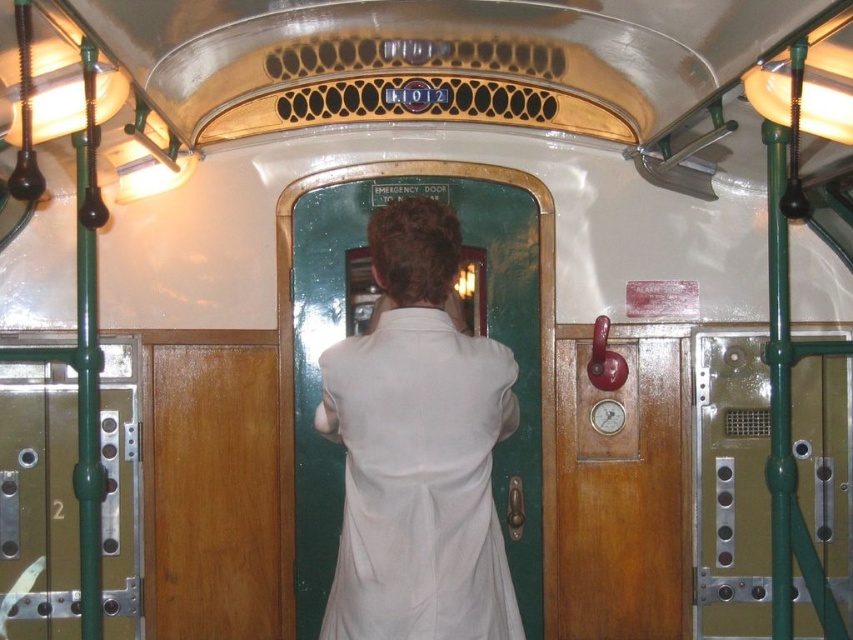
Based on the photo, you are a passenger in the vintage train car and want to find the emergency door. The white matte dress at center is blocking your view. Where should you move to so that you can see the emergency door clearly?

Since the white matte dress at center is located at point (419,481), moving to a position that is not obstructed by it would allow you to see the emergency door. The exact coordinates to move to depend on the layout of the train car, but moving to the left or right of the white matte dress at center should provide an unobstructed view of the emergency door.

You are a passenger in the vintage train car and want to reach the brown wooden door at right from your current position near the white matte dress at center. Can you walk directly to the door without moving around any objects?

The white matte dress at center and brown wooden door at right are 1.05 meters apart, so yes, you can walk directly to the door without needing to move around any objects since the distance is sufficient for movement.